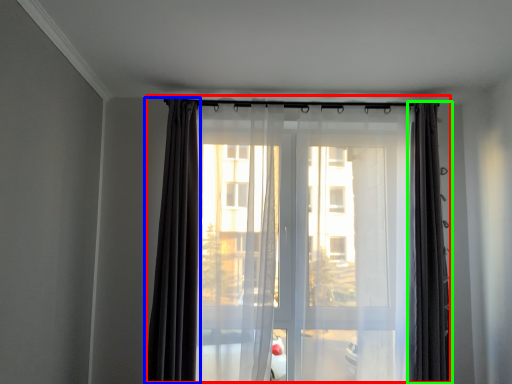
Question: Which object is positioned farthest from curtain (highlighted by a red box)? Select from curtain (highlighted by a blue box) and curtain (highlighted by a green box).

Choices:
 (A) curtain
 (B) curtain

Answer: (B)